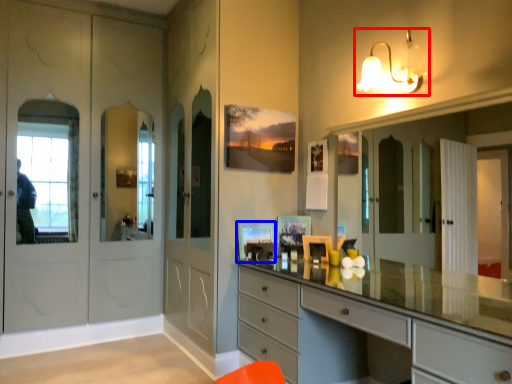
Question: Which object appears farthest to the camera in this image, light fixture (highlighted by a red box) or picture frame (highlighted by a blue box)?

Choices:
 (A) light fixture
 (B) picture frame

Answer: (B)